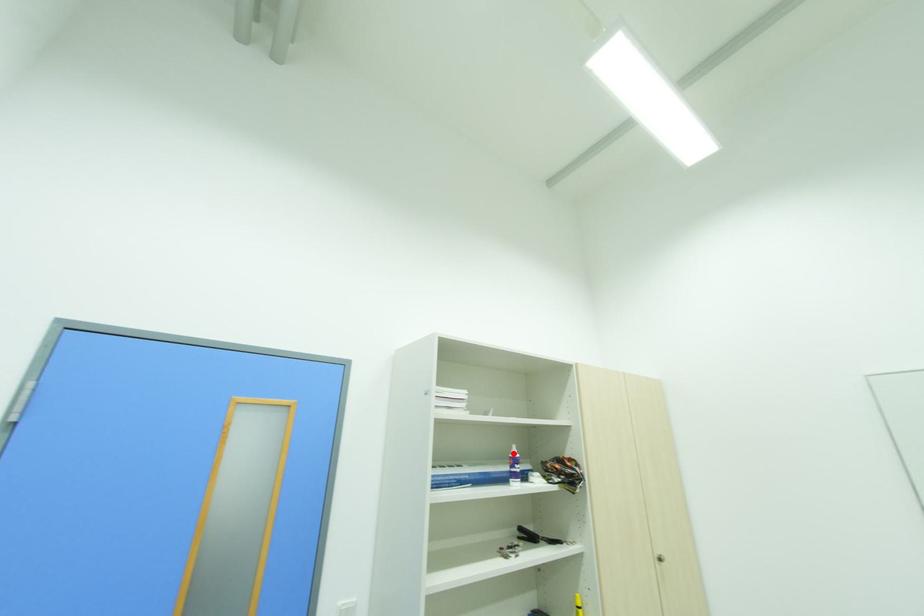
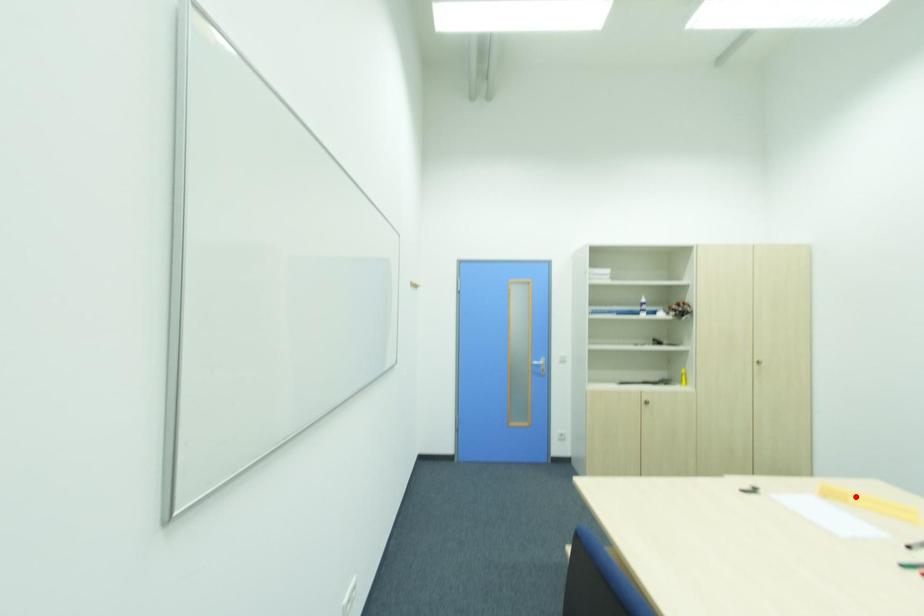
I am providing you with two images of the same scene from different viewpoints. A red point is marked on the first image and another point is marked on the second image. Is the red point in image1 aligned with the point shown in image2?

No